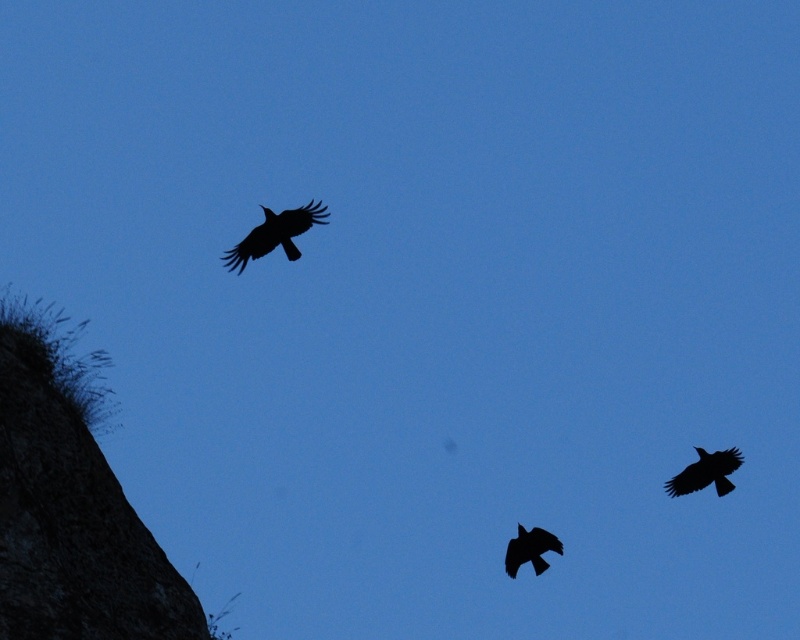
In the scene shown: Who is positioned more to the left, black matte vulture at upper center or black matte raven at upper right?

black matte vulture at upper center

Locate an element on the screen. black matte vulture at upper center is located at coordinates (276, 234).

Between point (277, 227) and point (686, 468), which one is positioned behind?

The point (686, 468) is behind.

Identify the location of black matte vulture at upper center. The image size is (800, 640). (276, 234).

Is black matte raven at upper right closer to camera compared to black matte raven at lower center?

No.

Who is more forward, (740, 460) or (536, 529)?

Point (536, 529) is in front.

Does point (700, 484) come in front of point (544, 561)?

No, (700, 484) is behind (544, 561).

Locate an element on the screen. This screenshot has height=640, width=800. black matte raven at upper right is located at coordinates (x=706, y=472).

Can you confirm if black matte vulture at upper center is positioned above black matte raven at lower center?

Indeed, black matte vulture at upper center is positioned over black matte raven at lower center.

Does point (318, 220) lie in front of point (510, 573)?

Yes, it is in front of point (510, 573).

The width and height of the screenshot is (800, 640). What are the coordinates of `black matte vulture at upper center` in the screenshot? It's located at (276, 234).